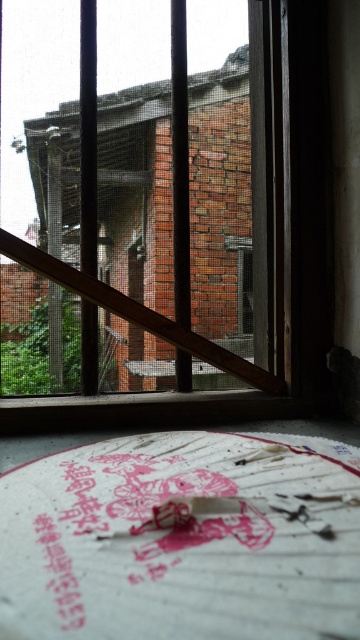
You are standing in a room with a window that has metal bars. You notice a point marked at coordinates [129,300]. Based on the scene description, what object does this point correspond to?

The point at coordinates [129,300] corresponds to the brick wall at center, as indicated by the Objects Description.

You are standing in front of the window with metal bars and looking at the two points marked in the image. Which point is closer to you, point (180, 22) or point (194, 332)?

Point (180, 22) is closer to you than point (194, 332).

In the scene shown: You are an observer looking through the window with metal bars. You notice a brick wall at center and a wooden at center. Which object is closer to you?

The brick wall at center is closer to you than the wooden at center because it is further to the viewer.